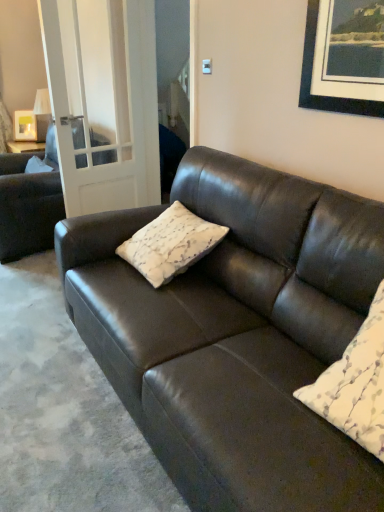
In order to click on matte white picture frame at upper left in this screenshot , I will do `click(25, 125)`.

In the image, there is a white textured pillow at center, arranged as the 1th pillow when viewed from the right. Where is `glass door above it (from the image's perspective)`? glass door above it (from the image's perspective) is located at coordinates (103, 100).

How different are the orientations of clear glass door at left and white textured pillow at center, acting as the first pillow starting from the front, in degrees?

There is a 99.5-degree angle between the facing directions of clear glass door at left and white textured pillow at center, acting as the first pillow starting from the front.

Is clear glass door at left facing towards white textured pillow at center, acting as the first pillow starting from the front?

Yes, clear glass door at left faces towards white textured pillow at center, acting as the first pillow starting from the front.

From the picture: Considering the relative positions of clear glass door at left and white textured pillow at center, arranged as the 1th pillow when viewed from the right, in the image provided, is clear glass door at left to the left of white textured pillow at center, arranged as the 1th pillow when viewed from the right, from the viewer's perspective?

Indeed, clear glass door at left is positioned on the left side of white textured pillow at center, arranged as the 1th pillow when viewed from the right.

Choose the correct answer: Is white textured pillow at center, arranged as the 1th pillow when viewed from the right, inside matte black couch at left, which is the second studio couch from right to left, or outside it?

white textured pillow at center, arranged as the 1th pillow when viewed from the right, is located beyond the bounds of matte black couch at left, which is the second studio couch from right to left.

Considering the positions of objects white textured pillow at center, acting as the 2th pillow starting from the back, and matte black couch at left, the 1th studio couch when ordered from back to front, in the image provided, who is in front, white textured pillow at center, acting as the 2th pillow starting from the back, or matte black couch at left, the 1th studio couch when ordered from back to front,?

white textured pillow at center, acting as the 2th pillow starting from the back, is closer to the camera.

Identify the location of the 2nd pillow positioned below the matte black couch at left, which is the second studio couch from right to left (from the image's perspective). (355, 385).

Is white textured pillow at center, the 2th pillow in the left-to-right sequence, turned away from matte black couch at left, placed as the second studio couch when sorted from front to back?

No, white textured pillow at center, the 2th pillow in the left-to-right sequence, is not facing the opposite direction of matte black couch at left, placed as the second studio couch when sorted from front to back.

How many degrees apart are the facing directions of white textured pillow at center, acting as the 2th pillow starting from the back, and matte white picture frame at upper left?

The facing directions of white textured pillow at center, acting as the 2th pillow starting from the back, and matte white picture frame at upper left are 61.6 degrees apart.

Which of these two, white textured pillow at center, the 2th pillow in the left-to-right sequence, or matte white picture frame at upper left, is smaller?

matte white picture frame at upper left.

Is point (374, 370) positioned behind point (23, 136)?

That is False.

From the image's perspective, would you say white textured pillow at center, the 2th pillow in the left-to-right sequence, is shown under matte white picture frame at upper left?

Indeed, from the image's perspective, white textured pillow at center, the 2th pillow in the left-to-right sequence, is shown beneath matte white picture frame at upper left.

Is clear glass door at left surrounding matte black couch at left, placed as the second studio couch when sorted from front to back?

No, matte black couch at left, placed as the second studio couch when sorted from front to back, is not surrounded by clear glass door at left.

From the image's perspective, is clear glass door at left under matte black couch at left, the 1th studio couch when ordered from back to front?

No.

Which is farther, (57, 168) or (16, 140)?

Positioned behind is point (16, 140).

Is matte black couch at left, arranged as the first studio couch when viewed from the left, wider than matte white picture frame at upper left?

Indeed, matte black couch at left, arranged as the first studio couch when viewed from the left, has a greater width compared to matte white picture frame at upper left.

In the scene shown: Is matte black couch at left, arranged as the first studio couch when viewed from the left, in front of matte white picture frame at upper left?

That is True.

Could matte white picture frame at upper left be considered to be inside matte black couch at left, arranged as the first studio couch when viewed from the left?

No, matte black couch at left, arranged as the first studio couch when viewed from the left, does not contain matte white picture frame at upper left.

From the image's perspective, is white textured pillow at center, acting as the 2th pillow starting from the back, below matte black couch at center, which is the first studio couch in right-to-left order?

Yes, from the image's perspective, white textured pillow at center, acting as the 2th pillow starting from the back, is below matte black couch at center, which is the first studio couch in right-to-left order.

Which object is more forward, white textured pillow at center, the 2th pillow in the left-to-right sequence, or matte black couch at center, positioned as the 2th studio couch in back-to-front order?

matte black couch at center, positioned as the 2th studio couch in back-to-front order, is more forward.

Considering the positions of objects white textured pillow at center, acting as the first pillow starting from the front, and matte black couch at center, which is the first studio couch in right-to-left order, in the image provided, who is more to the right, white textured pillow at center, acting as the first pillow starting from the front, or matte black couch at center, which is the first studio couch in right-to-left order,?

white textured pillow at center, acting as the first pillow starting from the front.

Based on the photo, would you say white textured pillow at center, arranged as the 1th pillow when viewed from the right, contains matte black couch at center, positioned as the 2th studio couch in back-to-front order?

No, white textured pillow at center, arranged as the 1th pillow when viewed from the right, does not contain matte black couch at center, positioned as the 2th studio couch in back-to-front order.

Is matte black couch at center, positioned as the 2th studio couch in back-to-front order, outside of white textured pillow at center, marked as the 1th pillow in a back-to-front arrangement?

Yes, matte black couch at center, positioned as the 2th studio couch in back-to-front order, is located beyond the bounds of white textured pillow at center, marked as the 1th pillow in a back-to-front arrangement.

In the scene shown: Can you tell me how much matte black couch at center, which is the first studio couch in right-to-left order, and white textured pillow at center, the 2th pillow positioned from the front, differ in facing direction?

1.11 degrees separate the facing orientations of matte black couch at center, which is the first studio couch in right-to-left order, and white textured pillow at center, the 2th pillow positioned from the front.

Does matte black couch at center, the 2th studio couch positioned from the left, have a smaller size compared to white textured pillow at center, the 2th pillow positioned from the front?

Actually, matte black couch at center, the 2th studio couch positioned from the left, might be larger than white textured pillow at center, the 2th pillow positioned from the front.

Where is `the 1st pillow positioned above the matte black couch at center, the 2th studio couch positioned from the left (from a real-world perspective)`? the 1st pillow positioned above the matte black couch at center, the 2th studio couch positioned from the left (from a real-world perspective) is located at coordinates (170, 244).

Where is `glass door that appears above the white textured pillow at center, the 2th pillow in the left-to-right sequence (from the image's perspective)`? The height and width of the screenshot is (512, 384). glass door that appears above the white textured pillow at center, the 2th pillow in the left-to-right sequence (from the image's perspective) is located at coordinates (103, 100).

Find the location of a particular element. The image size is (384, 512). pillow that is the 2nd one above the matte black couch at left, the 1th studio couch when ordered from back to front (from a real-world perspective) is located at coordinates (355, 385).

Which object lies further to the anchor point clear glass door at left, matte black couch at center, the 2th studio couch positioned from the left, or matte black couch at left, arranged as the first studio couch when viewed from the left?

matte black couch at center, the 2th studio couch positioned from the left, is further to clear glass door at left.

Which object lies nearer to the anchor point matte black couch at left, placed as the second studio couch when sorted from front to back, clear glass door at left or matte black couch at center, which is the first studio couch in right-to-left order?

→ Based on the image, clear glass door at left appears to be nearer to matte black couch at left, placed as the second studio couch when sorted from front to back.

Considering their positions, is matte black couch at left, the 1th studio couch when ordered from back to front, positioned closer to white textured pillow at center, acting as the 2th pillow starting from the back, than matte black couch at center, which is the first studio couch in right-to-left order?

matte black couch at center, which is the first studio couch in right-to-left order, is positioned closer to the anchor white textured pillow at center, acting as the 2th pillow starting from the back.

Considering their positions, is matte black couch at center, positioned as the 2th studio couch in back-to-front order, positioned further to matte white picture frame at upper left than white textured pillow at center, marked as the 1th pillow in a back-to-front arrangement?

matte black couch at center, positioned as the 2th studio couch in back-to-front order, is further to matte white picture frame at upper left.

Which object lies nearer to the anchor point matte white picture frame at upper left, white textured pillow at center, arranged as the 1th pillow when viewed from the right, or matte black couch at left, which is the second studio couch from right to left?

matte black couch at left, which is the second studio couch from right to left, is closer to matte white picture frame at upper left.

Considering their positions, is white textured pillow at center, acting as the first pillow starting from the front, positioned closer to matte black couch at left, the 1th studio couch when ordered from back to front, than clear glass door at left?

clear glass door at left is closer to matte black couch at left, the 1th studio couch when ordered from back to front.

Estimate the real-world distances between objects in this image. Which object is closer to matte white picture frame at upper left, white textured pillow at center, the 2th pillow in the left-to-right sequence, or white textured pillow at center, placed as the first pillow when sorted from left to right?

Among the two, white textured pillow at center, placed as the first pillow when sorted from left to right, is located nearer to matte white picture frame at upper left.

Looking at the image, which one is located further to matte black couch at center, which ranks as the 1th studio couch in front-to-back order, matte white picture frame at upper left or matte black couch at left, which is the second studio couch from right to left?

matte white picture frame at upper left.

Where is `glass door between matte black couch at left, placed as the second studio couch when sorted from front to back, and white textured pillow at center, placed as the first pillow when sorted from left to right`? This screenshot has width=384, height=512. glass door between matte black couch at left, placed as the second studio couch when sorted from front to back, and white textured pillow at center, placed as the first pillow when sorted from left to right is located at coordinates (x=103, y=100).

The width and height of the screenshot is (384, 512). I want to click on glass door positioned between white textured pillow at center, arranged as the 1th pillow when viewed from the right, and matte black couch at left, arranged as the first studio couch when viewed from the left, from near to far, so click(103, 100).

Find the location of a particular element. Image resolution: width=384 pixels, height=512 pixels. glass door between white textured pillow at center, the 2th pillow in the left-to-right sequence, and matte white picture frame at upper left, along the z-axis is located at coordinates (103, 100).

Locate an element on the screen. Image resolution: width=384 pixels, height=512 pixels. glass door between white textured pillow at center, placed as the first pillow when sorted from left to right, and matte white picture frame at upper left in the front-back direction is located at coordinates (103, 100).